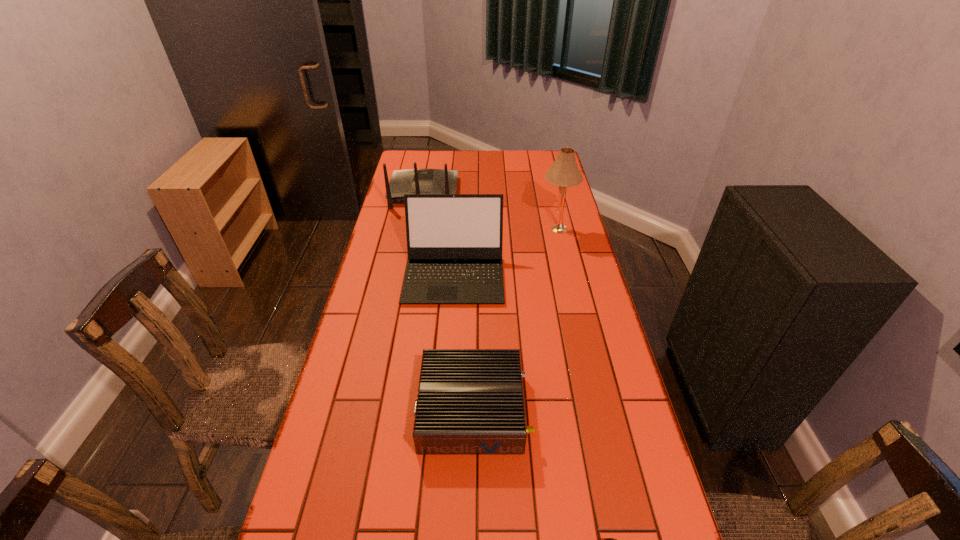
Locate an element on the screen. the tallest object is located at coordinates (564, 172).

Where is `the second farthest object`? the second farthest object is located at coordinates (564, 172).

The height and width of the screenshot is (540, 960). I want to click on laptop, so click(x=454, y=241).

Locate an element on the screen. The image size is (960, 540). the taller router is located at coordinates click(x=410, y=181).

I want to click on the farthest object, so click(410, 181).

Identify the location of the fourth tallest object. (470, 401).

Identify the location of the nearer router. (470, 401).

Locate an element on the screen. The width and height of the screenshot is (960, 540). free region located on the left of the tallest object is located at coordinates (448, 230).

Where is `vacant space located 0.110m on the surface of the laptop`? Image resolution: width=960 pixels, height=540 pixels. vacant space located 0.110m on the surface of the laptop is located at coordinates tap(450, 333).

At what (x,y) coordinates should I click in order to perform the action: click on free space located on the front-facing side of the farther router. Please return your answer as a coordinate pair (x, y). The height and width of the screenshot is (540, 960). Looking at the image, I should click on (428, 167).